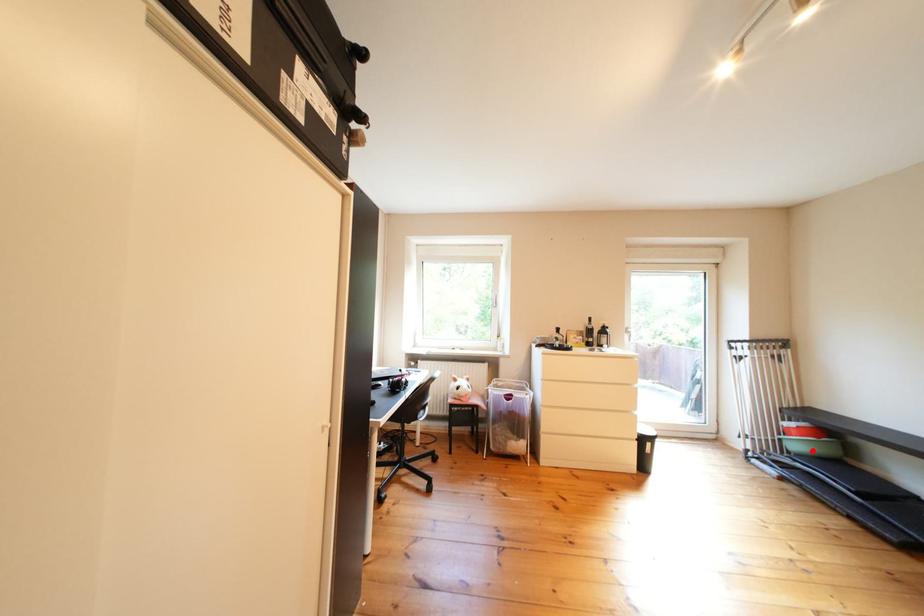
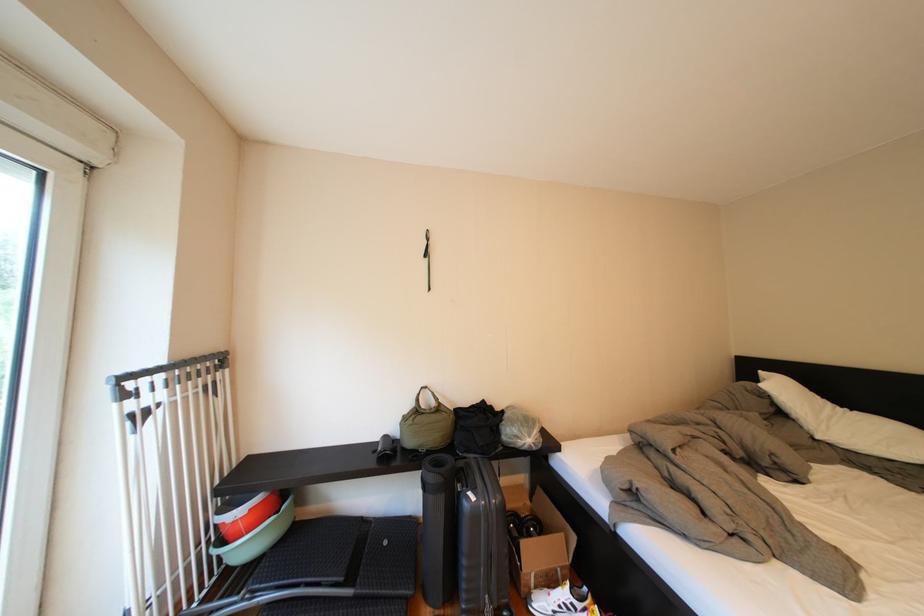
Question: I am providing you with two images of the same scene from different viewpoints. A red point is marked on the first image. Can you still see the location of the red point in image 2?

Choices:
 (A) Yes
 (B) No

Answer: (A)